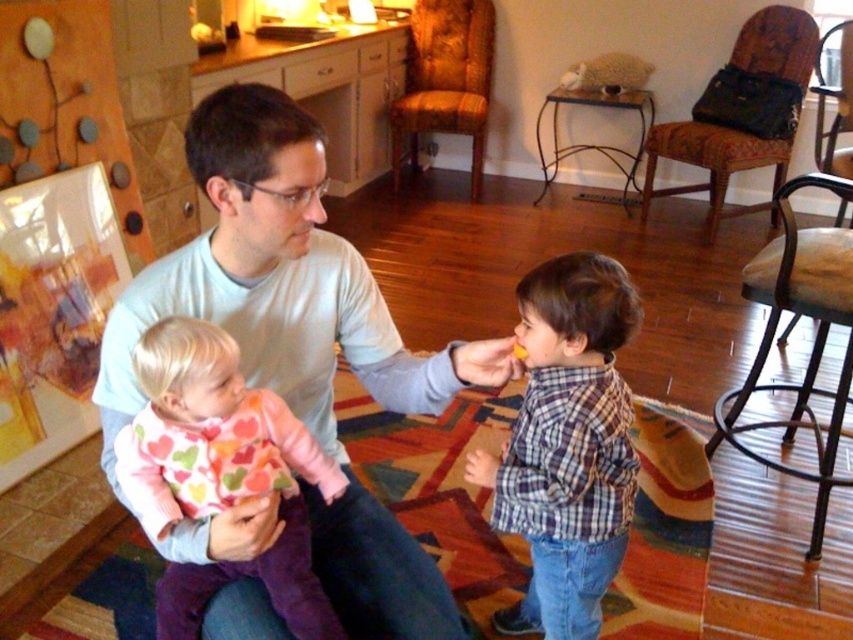
Which of these two, light blue long-sleeve shirt at center or plaid cotton shirt at center, stands taller?

Standing taller between the two is light blue long-sleeve shirt at center.

What do you see at coordinates (300, 340) in the screenshot?
I see `light blue long-sleeve shirt at center` at bounding box center [300, 340].

Who is more distant from viewer, (x=242, y=156) or (x=554, y=308)?

Positioned behind is point (x=554, y=308).

Identify the location of light blue long-sleeve shirt at center. The image size is (853, 640). (300, 340).

Is light blue long-sleeve shirt at center closer to camera compared to pink heart-patterned sweater at left?

Yes, light blue long-sleeve shirt at center is closer to the viewer.

Looking at this image, who is positioned more to the left, light blue long-sleeve shirt at center or pink heart-patterned sweater at left?

Positioned to the left is pink heart-patterned sweater at left.

Where is `light blue long-sleeve shirt at center`? light blue long-sleeve shirt at center is located at coordinates (300, 340).

Is plaid cotton shirt at center bigger than pink heart-patterned sweater at left?

Yes.

Is point (601, 410) behind point (175, 340)?

Yes, it is behind point (175, 340).

You are a GUI agent. You are given a task and a screenshot of the screen. Output one action in this format:
    pyautogui.click(x=<x>, y=<y>)
    Task: Click on the plaid cotton shirt at center
    This screenshot has width=853, height=640.
    Given the screenshot: What is the action you would take?
    pyautogui.click(x=567, y=444)